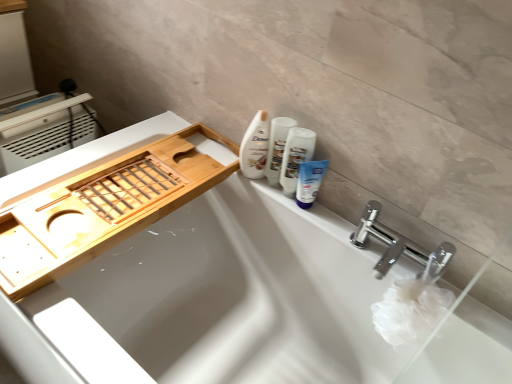
Question: Is white glossy lotion at upper right, arranged as the first toiletry when viewed from the left, spatially inside blue matte tube at upper right, the 1th toiletry positioned from the right, or outside of it?

Choices:
 (A) inside
 (B) outside

Answer: (B)

Question: Visually, is white glossy lotion at upper right, the 2th toiletry positioned from the right, positioned to the left or to the right of blue matte tube at upper right, the 1th toiletry positioned from the right?

Choices:
 (A) right
 (B) left

Answer: (B)

Question: Based on their relative distances, which object is farther from the blue matte tube at upper right, the 1th toiletry positioned from the right?

Choices:
 (A) white glossy bottle at upper center
 (B) white glossy bathtub at upper center
 (C) white glossy lotion at upper right, arranged as the first toiletry when viewed from the left
 (D) white glossy tube at upper right

Answer: (B)

Question: Which is nearer to the white glossy bathtub at upper center?

Choices:
 (A) blue matte tube at upper right, the second toiletry in the left-to-right sequence
 (B) white glossy bottle at upper center
 (C) white glossy lotion at upper right, arranged as the first toiletry when viewed from the left
 (D) white glossy tube at upper right

Answer: (A)